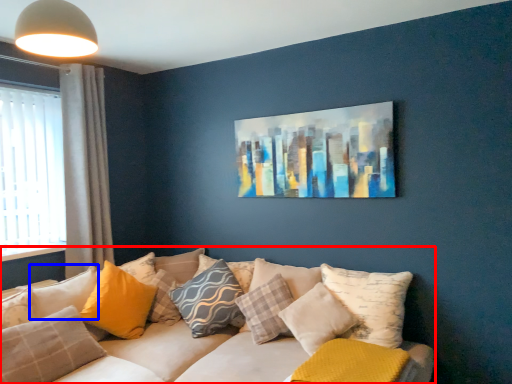
Question: Which of the following is the closest to the observer, studio couch (highlighted by a red box) or pillow (highlighted by a blue box)?

Choices:
 (A) studio couch
 (B) pillow

Answer: (A)